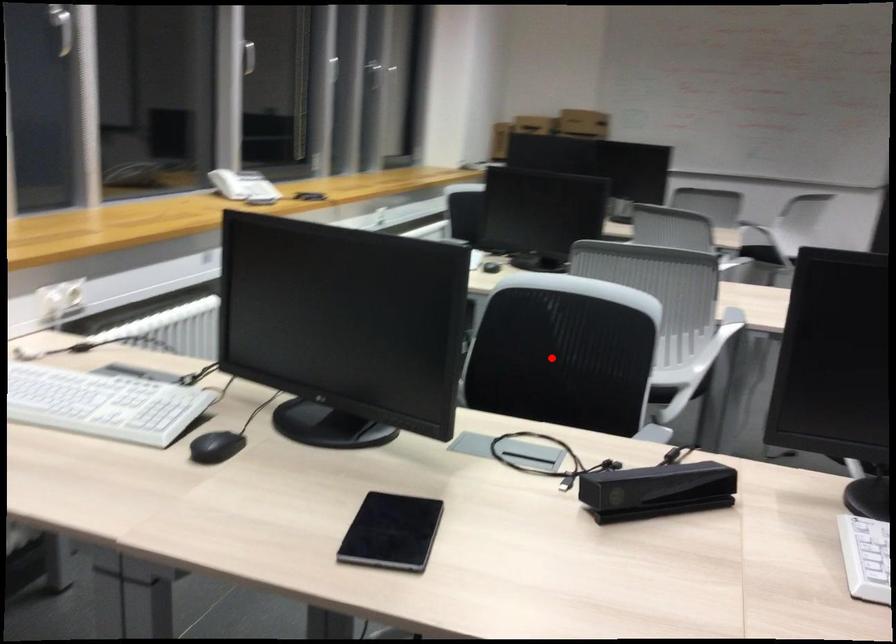
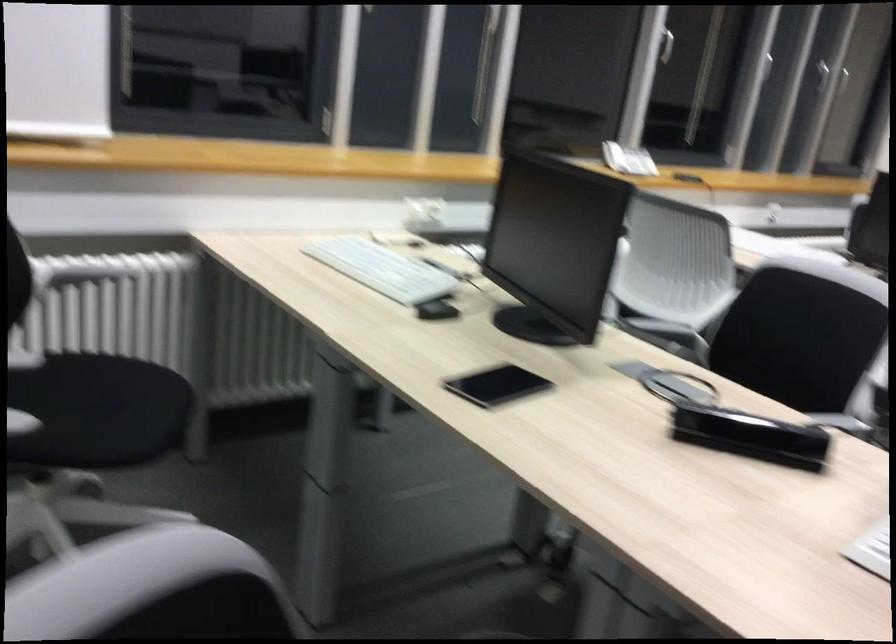
Locate, in the second image, the point that corresponds to the highlighted location in the first image.

(798, 337)